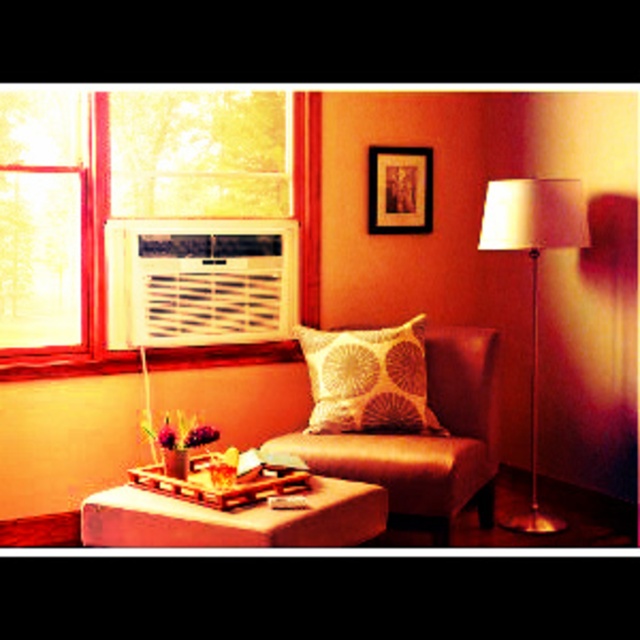
Does point (332, 385) lie in front of point (499, 232)?

Yes, point (332, 385) is closer to viewer.

Consider the image. Is white textured pillow at center shorter than metallic gold floor lamp at right?

Indeed, white textured pillow at center has a lesser height compared to metallic gold floor lamp at right.

Which is behind, point (388, 364) or point (577, 230)?

Positioned behind is point (388, 364).

Locate an element on the screen. This screenshot has height=640, width=640. white textured pillow at center is located at coordinates (368, 378).

Which of these two, satin beige armchair at center or wooden tray at lower center, stands shorter?

Standing shorter between the two is wooden tray at lower center.

Find the location of a particular element. The image size is (640, 640). satin beige armchair at center is located at coordinates (428, 440).

Where is `satin beige armchair at center`? satin beige armchair at center is located at coordinates (428, 440).

Which of these two, white plastic air conditioner at upper left or metallic gold floor lamp at right, stands taller?

metallic gold floor lamp at right is taller.

Is white plastic air conditioner at upper left wider than metallic gold floor lamp at right?

Yes.

Where is `white plastic air conditioner at upper left`? The image size is (640, 640). white plastic air conditioner at upper left is located at coordinates (86, 285).